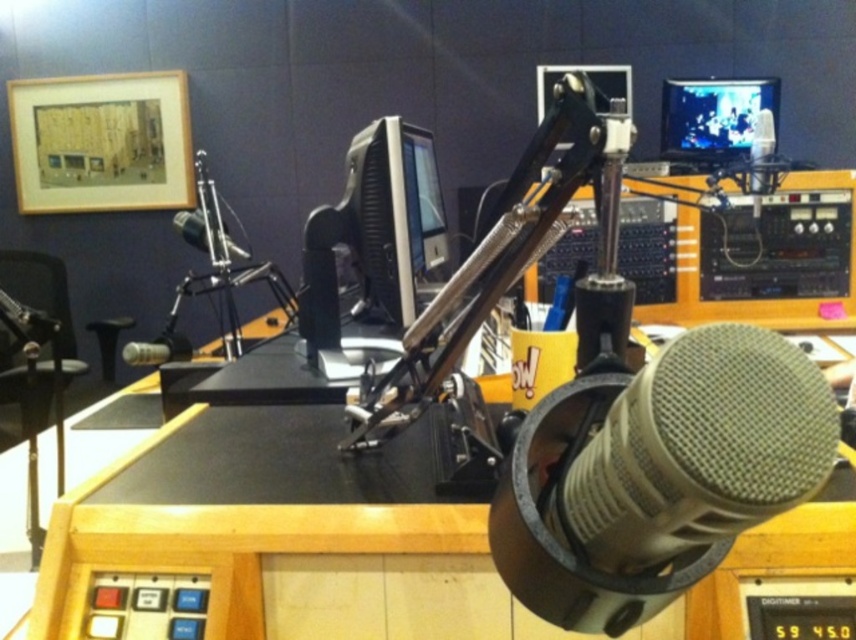
In the scene shown: You are a sound engineer in the studio and need to adjust the distance between the metallic silver microphone at center and the satin black microphone at center to exactly 12 inches. Currently, they are 14.01 inches apart. What should you do?

The metallic silver microphone at center is currently 14.01 inches away from the satin black microphone at center. To reduce the distance to 12 inches, you should move the metallic silver microphone at center closer to the satin black microphone at center by approximately 2.01 inches.

You are a sound technician in a recording studio. You need to adjust the distance between the matte gray microphone at center and the satin silver microphone at upper right to 2 meters for optimal sound quality. Is the current distance sufficient?

The matte gray microphone at center is currently 2.06 meters from the satin silver microphone at upper right, which is slightly more than the required 2 meters. Therefore, the current distance is sufficient for optimal sound quality.

You are a sound engineer in the studio. You need to adjust the microphone closer to the speaker. Which microphone, the matte gray microphone at center or the satin silver microphone at upper right, is positioned closer to the speaker?

The matte gray microphone at center is positioned closer to the speaker because it is in front of the satin silver microphone at upper right.